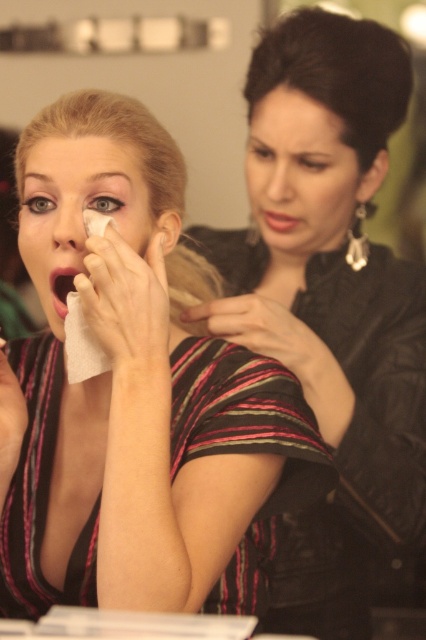
Question: Which object is the closest to the pink matte lips at center?

Choices:
 (A) matte black dress at center
 (B) black leather jacket at upper right
 (C) matte black face at center

Answer: (C)

Question: Which object is the closest to the matte black dress at center?

Choices:
 (A) matte black face at center
 (B) smooth skin face at center
 (C) black leather jacket at upper right
 (D) pink matte lips at center

Answer: (A)

Question: Which of the following is the farthest from the observer?

Choices:
 (A) (293, 179)
 (B) (57, 291)

Answer: (A)

Question: Considering the relative positions of matte black dress at center and black leather jacket at upper right in the image provided, where is matte black dress at center located with respect to black leather jacket at upper right?

Choices:
 (A) right
 (B) left

Answer: (B)

Question: Is matte black dress at center bigger than matte red lipstick at center?

Choices:
 (A) yes
 (B) no

Answer: (A)

Question: In this image, where is matte black dress at center located relative to matte black face at center?

Choices:
 (A) above
 (B) below

Answer: (B)